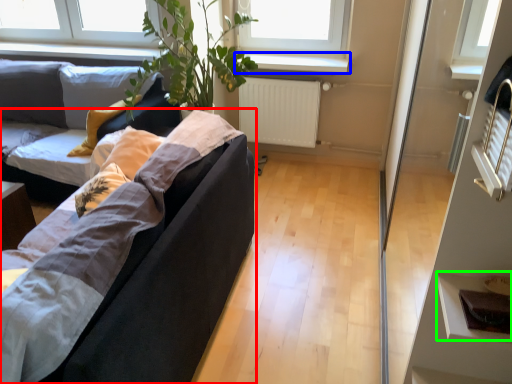
Question: Which object is positioned closest to studio couch (highlighted by a red box)? Select from window sill (highlighted by a blue box) and shelf (highlighted by a green box).

Choices:
 (A) window sill
 (B) shelf

Answer: (B)